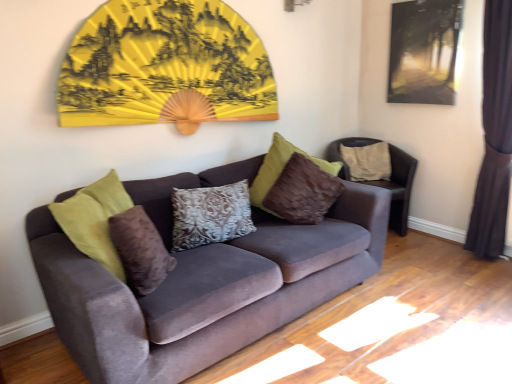
Question: Which direction should I rotate to look at brown velvet pillow at center, positioned as the 3th pillow in back-to-front order, — up or down?

Choices:
 (A) down
 (B) up

Answer: (A)

Question: Does brown velvet pillow at center, placed as the 1th pillow when sorted from front to back, have a smaller size compared to patterned fabric pillow at center, positioned as the 2th pillow in back-to-front order?

Choices:
 (A) yes
 (B) no

Answer: (A)

Question: Is brown velvet pillow at center, the first pillow when ordered from left to right, at the left side of patterned fabric pillow at center, placed as the 2th pillow when sorted from right to left?

Choices:
 (A) no
 (B) yes

Answer: (B)

Question: Is the depth of brown velvet pillow at center, positioned as the 3th pillow in back-to-front order, greater than that of patterned fabric pillow at center, positioned as the 2th pillow in back-to-front order?

Choices:
 (A) yes
 (B) no

Answer: (B)

Question: From the image's perspective, is brown velvet pillow at center, placed as the 3th pillow when sorted from right to left, above patterned fabric pillow at center, positioned as the 2th pillow in back-to-front order?

Choices:
 (A) yes
 (B) no

Answer: (B)

Question: Is patterned fabric pillow at center, the 2th pillow from the left, a part of brown velvet pillow at center, positioned as the 3th pillow in back-to-front order?

Choices:
 (A) yes
 (B) no

Answer: (B)

Question: From the image's perspective, is brown velvet pillow at center, placed as the 1th pillow when sorted from front to back, below patterned fabric pillow at center, which is the second pillow from front to back?

Choices:
 (A) no
 (B) yes

Answer: (B)

Question: From a real-world perspective, is beige fabric pillow at right, which is the third pillow from front to back, physically below dark brown velvet curtain at right?

Choices:
 (A) yes
 (B) no

Answer: (A)

Question: Can you see beige fabric pillow at right, which is the third pillow from front to back, touching dark brown velvet curtain at right?

Choices:
 (A) no
 (B) yes

Answer: (A)

Question: Is the depth of beige fabric pillow at right, arranged as the first pillow when viewed from the back, less than that of dark brown velvet curtain at right?

Choices:
 (A) yes
 (B) no

Answer: (B)

Question: Is beige fabric pillow at right, arranged as the first pillow when viewed from the back, not close to dark brown velvet curtain at right?

Choices:
 (A) yes
 (B) no

Answer: (B)

Question: Considering the relative sizes of beige fabric pillow at right, arranged as the first pillow when viewed from the back, and dark brown velvet curtain at right in the image provided, is beige fabric pillow at right, arranged as the first pillow when viewed from the back, shorter than dark brown velvet curtain at right?

Choices:
 (A) yes
 (B) no

Answer: (A)

Question: Does beige fabric pillow at right, which is the third pillow from front to back, appear on the left side of dark brown velvet curtain at right?

Choices:
 (A) yes
 (B) no

Answer: (A)

Question: Is velvet couch at center closer to camera compared to velvet brown chair at right?

Choices:
 (A) no
 (B) yes

Answer: (B)